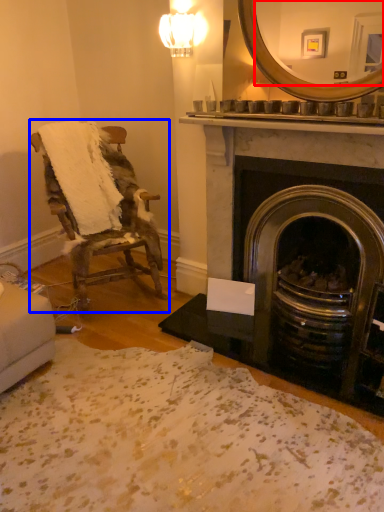
Question: Which object is further to the camera taking this photo, mirror (highlighted by a red box) or chair (highlighted by a blue box)?

Choices:
 (A) mirror
 (B) chair

Answer: (B)